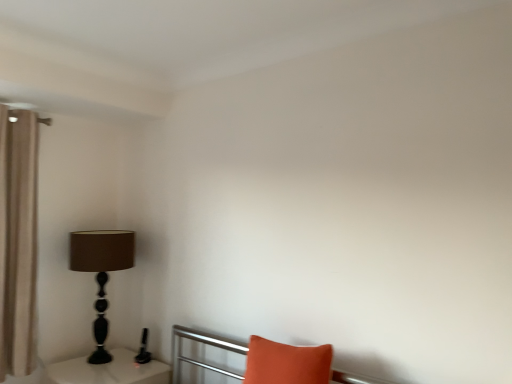
Question: From a real-world perspective, is beige fabric curtain at left positioned over white glossy table at lower left based on gravity?

Choices:
 (A) yes
 (B) no

Answer: (A)

Question: Does beige fabric curtain at left have a lesser width compared to white glossy table at lower left?

Choices:
 (A) no
 (B) yes

Answer: (B)

Question: From the image's perspective, is beige fabric curtain at left over white glossy table at lower left?

Choices:
 (A) no
 (B) yes

Answer: (B)

Question: Is beige fabric curtain at left looking in the opposite direction of white glossy table at lower left?

Choices:
 (A) yes
 (B) no

Answer: (B)

Question: From a real-world perspective, is beige fabric curtain at left below white glossy table at lower left?

Choices:
 (A) no
 (B) yes

Answer: (A)

Question: Is beige fabric curtain at left taller or shorter than white glossy table at lower left?

Choices:
 (A) short
 (B) tall

Answer: (B)

Question: From a real-world perspective, is beige fabric curtain at left positioned above or below white glossy table at lower left?

Choices:
 (A) below
 (B) above

Answer: (B)

Question: Is beige fabric curtain at left in front of or behind white glossy table at lower left in the image?

Choices:
 (A) behind
 (B) front

Answer: (A)

Question: Considering the positions of beige fabric curtain at left and white glossy table at lower left in the image, is beige fabric curtain at left wider or thinner than white glossy table at lower left?

Choices:
 (A) wide
 (B) thin

Answer: (B)

Question: Looking at their shapes, would you say white glossy table at lower left is wider or thinner than matte black lamp at left?

Choices:
 (A) wide
 (B) thin

Answer: (A)

Question: Relative to matte black lamp at left, is white glossy table at lower left in front or behind?

Choices:
 (A) front
 (B) behind

Answer: (A)

Question: Considering the relative positions of white glossy table at lower left and matte black lamp at left in the image provided, is white glossy table at lower left to the left or to the right of matte black lamp at left?

Choices:
 (A) left
 (B) right

Answer: (B)

Question: From a real-world perspective, relative to matte black lamp at left, is white glossy table at lower left vertically above or below?

Choices:
 (A) below
 (B) above

Answer: (A)

Question: Based on their sizes in the image, would you say matte black lamp at left is bigger or smaller than white glossy table at lower left?

Choices:
 (A) small
 (B) big

Answer: (B)

Question: Considering their positions, is matte black lamp at left located in front of or behind white glossy table at lower left?

Choices:
 (A) front
 (B) behind

Answer: (B)